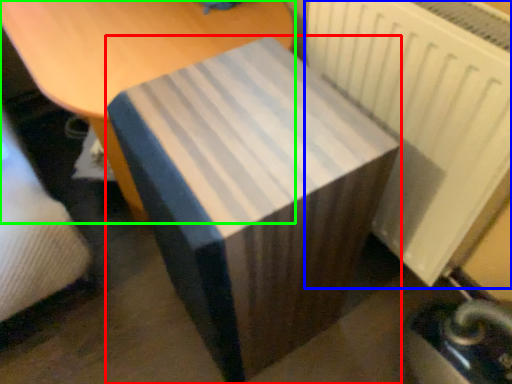
Question: Which object is the farthest from table (highlighted by a red box)? Choose among these: radiator (highlighted by a blue box) or furniture (highlighted by a green box).

Choices:
 (A) radiator
 (B) furniture

Answer: (B)